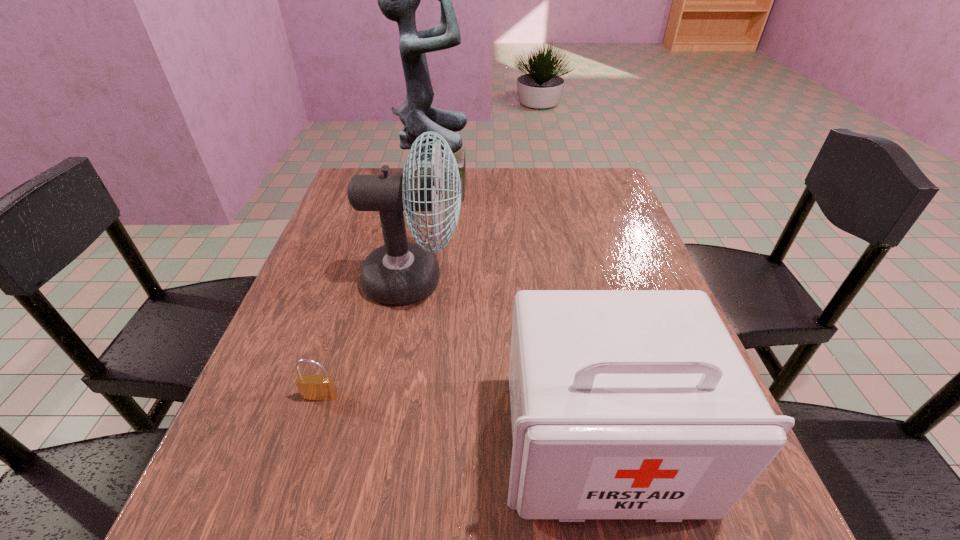
The width and height of the screenshot is (960, 540). Find the location of `the tallest object`. the tallest object is located at coordinates (398, 0).

I want to click on sculpture, so click(398, 0).

Locate an element on the screen. This screenshot has height=540, width=960. fan is located at coordinates (399, 272).

Locate an element on the screen. The width and height of the screenshot is (960, 540). the second farthest object is located at coordinates (399, 272).

Identify the location of the third tallest object. (625, 404).

Where is `the first-aid kit`? Image resolution: width=960 pixels, height=540 pixels. the first-aid kit is located at coordinates (625, 404).

The width and height of the screenshot is (960, 540). Identify the location of the shortest object. (311, 387).

Find the location of a particular element. free space located on the face of the sculpture is located at coordinates (492, 186).

Locate an element on the screen. free space located in front of the fan where the airflow is directed is located at coordinates (491, 280).

The height and width of the screenshot is (540, 960). Find the location of `free spot located 0.130m on the front-facing side of the padlock`. free spot located 0.130m on the front-facing side of the padlock is located at coordinates (295, 476).